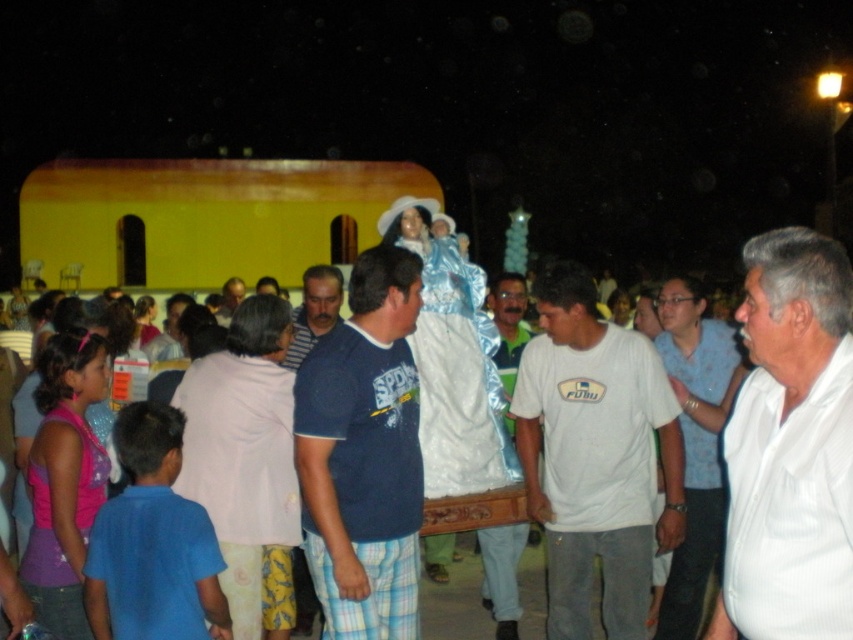
Is white cotton t-shirt at center closer to the viewer compared to blue cotton shirt at center?

No, white cotton t-shirt at center is behind blue cotton shirt at center.

Is point (606, 488) in front of point (372, 266)?

Yes, point (606, 488) is closer to viewer.

Is point (611, 369) farther from viewer compared to point (347, 516)?

Yes, it is.

Find the location of a particular element. This screenshot has height=640, width=853. white cotton t-shirt at center is located at coordinates (595, 456).

Who is higher up, white cotton shirt at center or dark blue shirt at center?

Positioned higher is dark blue shirt at center.

Is point (679, 321) positioned after point (323, 310)?

No, it is in front of (323, 310).

Is point (692, 560) positioned after point (299, 353)?

No, it is in front of (299, 353).

This screenshot has width=853, height=640. I want to click on white cotton shirt at center, so tap(695, 442).

Does white cotton t-shirt at center appear on the right side of dark blue shirt at center?

Yes, white cotton t-shirt at center is to the right of dark blue shirt at center.

Between white cotton t-shirt at center and dark blue shirt at center, which one appears on the left side from the viewer's perspective?

dark blue shirt at center is more to the left.

Who is more distant from viewer, [531,369] or [331,298]?

The point [331,298] is behind.

What are the coordinates of `white cotton t-shirt at center` in the screenshot? It's located at click(595, 456).